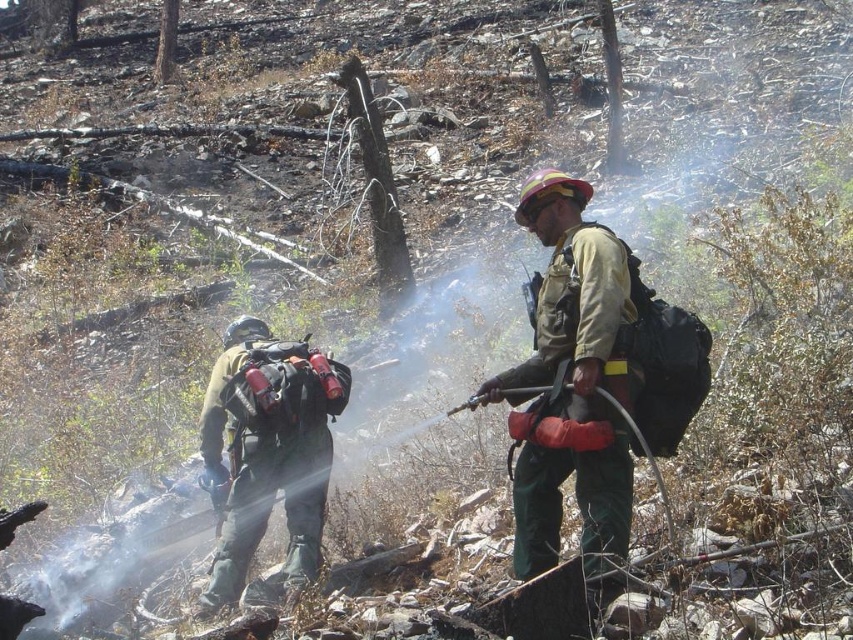
Question: Can you confirm if green matte uniform at center is wider than green matte uniform at left?

Choices:
 (A) yes
 (B) no

Answer: (B)

Question: Which of the following is the farthest from the observer?

Choices:
 (A) green matte uniform at left
 (B) green matte uniform at center

Answer: (A)

Question: Is green matte uniform at center bigger than green matte uniform at left?

Choices:
 (A) no
 (B) yes

Answer: (A)

Question: Is green matte uniform at center below green matte uniform at left?

Choices:
 (A) yes
 (B) no

Answer: (B)

Question: Which point is farther to the camera?

Choices:
 (A) click(x=286, y=420)
 (B) click(x=553, y=378)

Answer: (A)